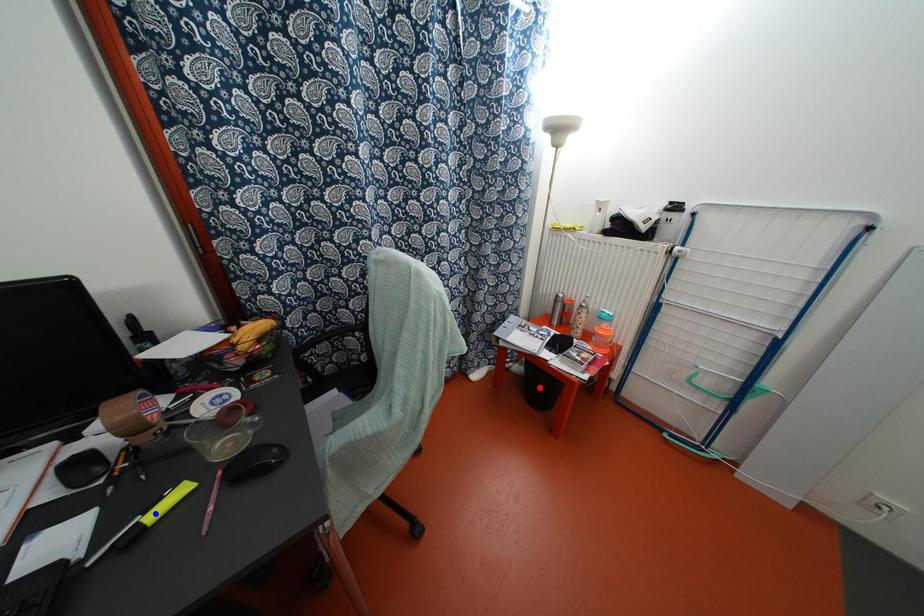
Question: Which of the two points in the image is closer to the camera?

Choices:
 (A) Blue point is closer.
 (B) Red point is closer.

Answer: (A)